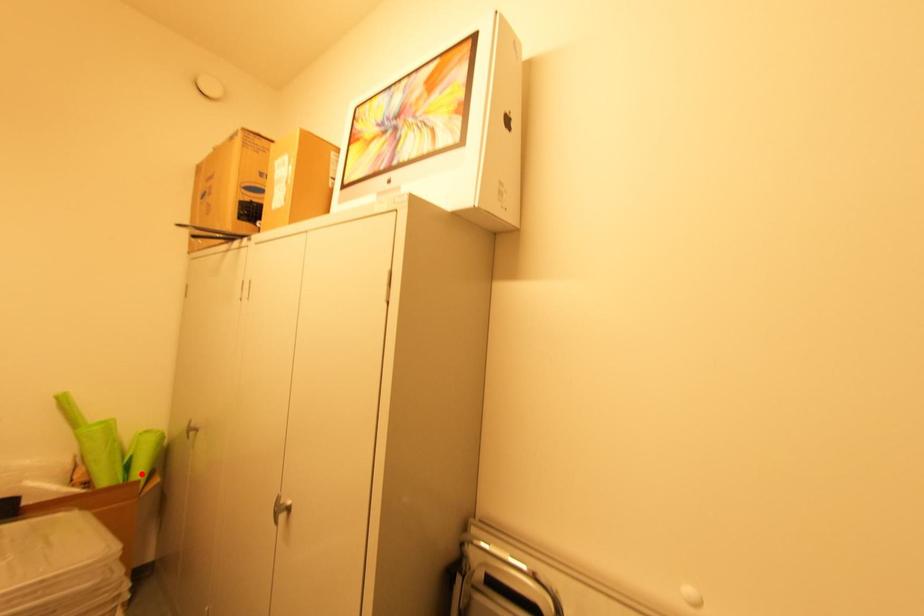
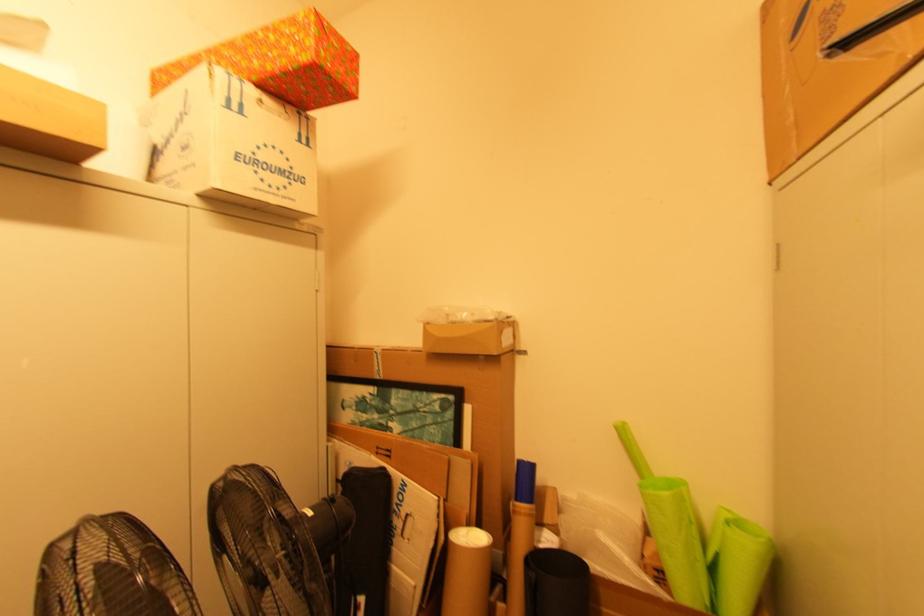
Where in the second image is the point corresponding to the highlighted location from the first image?

(736, 605)